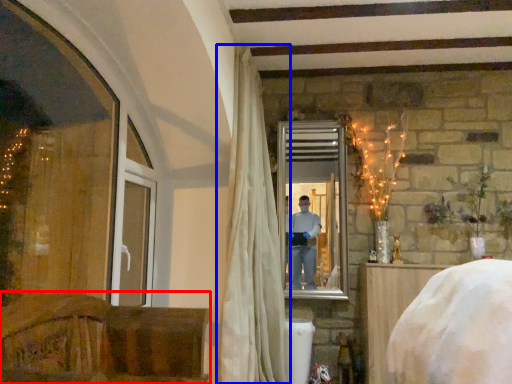
Question: Among these objects, which one is farthest to the camera, furniture (highlighted by a red box) or curtain (highlighted by a blue box)?

Choices:
 (A) furniture
 (B) curtain

Answer: (B)